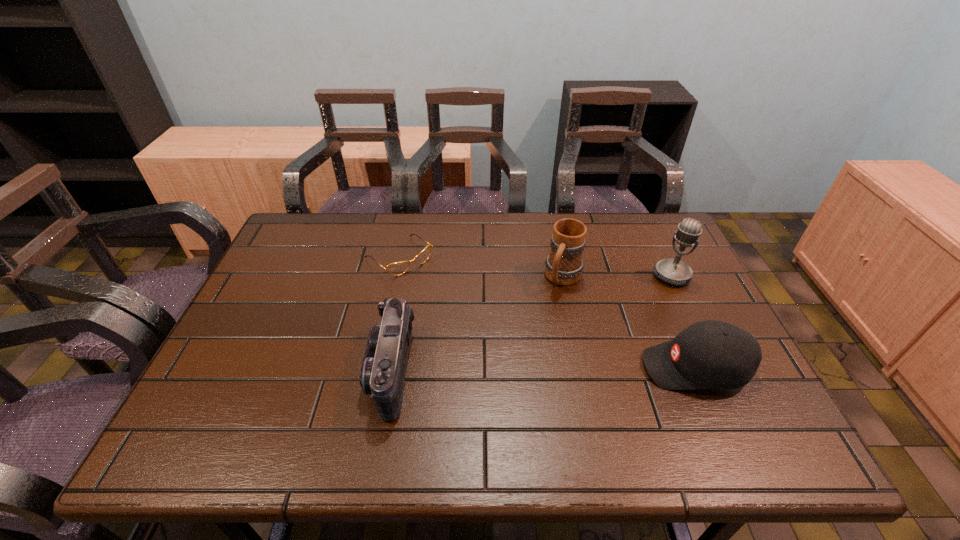
Identify the location of vacant space situated 0.170m with a logo on the front of the baseball cap. (571, 368).

The height and width of the screenshot is (540, 960). Find the location of `free region located with a logo on the front of the baseball cap`. free region located with a logo on the front of the baseball cap is located at coordinates (580, 368).

Where is `vacant space located 0.060m on the front-facing side of the tallest object`? Image resolution: width=960 pixels, height=540 pixels. vacant space located 0.060m on the front-facing side of the tallest object is located at coordinates (653, 295).

You are a GUI agent. You are given a task and a screenshot of the screen. Output one action in this format:
    pyautogui.click(x=<x>, y=<y>)
    Task: Click on the free spot located on the front-facing side of the tallest object
    The width and height of the screenshot is (960, 540).
    Given the screenshot: What is the action you would take?
    click(606, 344)

The height and width of the screenshot is (540, 960). In order to click on vacant region located on the front-facing side of the tallest object in this screenshot , I will do `click(590, 360)`.

Identify the location of vacant region located 0.130m on the side of the third object from right to left with the handle. (540, 324).

The image size is (960, 540). In order to click on free space located 0.180m on the side of the third object from right to left with the handle in this screenshot , I will do `click(533, 337)`.

The image size is (960, 540). I want to click on free space located on the side of the third object from right to left with the handle, so click(x=523, y=354).

The image size is (960, 540). I want to click on vacant space located 0.370m on the front-facing side of the shortest object, so click(506, 350).

Where is `vacant space situated 0.140m on the front-facing side of the shortest object`? The image size is (960, 540). vacant space situated 0.140m on the front-facing side of the shortest object is located at coordinates (448, 300).